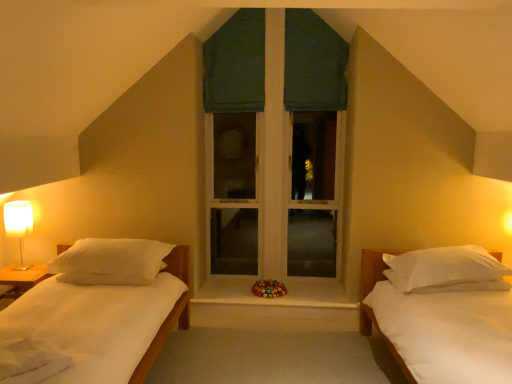
Describe the element at coordinates (236, 64) in the screenshot. I see `dark green fabric at center, acting as the 2th curtain starting from the right` at that location.

You are a GUI agent. You are given a task and a screenshot of the screen. Output one action in this format:
    pyautogui.click(x=<x>, y=<y>)
    Task: Click on the white matte bed at right
    
    Given the screenshot: What is the action you would take?
    pyautogui.click(x=372, y=269)

Describe the element at coordinates (313, 63) in the screenshot. This screenshot has height=384, width=512. I see `green fabric curtain at upper center, acting as the first curtain starting from the right` at that location.

This screenshot has height=384, width=512. What do you see at coordinates (274, 298) in the screenshot?
I see `wooden at center` at bounding box center [274, 298].

The image size is (512, 384). What do you see at coordinates (446, 270) in the screenshot?
I see `white soft pillow at right, placed as the first pillow when sorted from right to left` at bounding box center [446, 270].

Find the location of `dark green fabric at center, acting as the 2th curtain starting from the right`. dark green fabric at center, acting as the 2th curtain starting from the right is located at coordinates (236, 64).

From the image's perspective, is wooden at center located above or below green fabric curtain at upper center, acting as the first curtain starting from the right?

wooden at center is below green fabric curtain at upper center, acting as the first curtain starting from the right.

Could green fabric curtain at upper center, acting as the first curtain starting from the right, be considered to be inside wooden at center?

Actually, green fabric curtain at upper center, acting as the first curtain starting from the right, is outside wooden at center.

In the scene shown: Between wooden at center and green fabric curtain at upper center, which is the 2th curtain in left-to-right order, which one has more height?

green fabric curtain at upper center, which is the 2th curtain in left-to-right order.

This screenshot has width=512, height=384. In order to click on window sill that appears on the left of green fabric curtain at upper center, which is the 2th curtain in left-to-right order in this screenshot , I will do `click(274, 298)`.

Is dark green fabric at center, acting as the 2th curtain starting from the right, inside green fabric window at center?

Indeed, dark green fabric at center, acting as the 2th curtain starting from the right, is located within green fabric window at center.

From the image's perspective, is green fabric window at center located above or below dark green fabric at center, acting as the 2th curtain starting from the right?

green fabric window at center is situated lower than dark green fabric at center, acting as the 2th curtain starting from the right, in the image.

Can you tell me how much green fabric window at center and dark green fabric at center, acting as the 2th curtain starting from the right, differ in facing direction?

The angular difference between green fabric window at center and dark green fabric at center, acting as the 2th curtain starting from the right, is 1.05 degrees.

Does green fabric window at center come behind dark green fabric at center, acting as the 2th curtain starting from the right?

No, the depth of green fabric window at center is less than that of dark green fabric at center, acting as the 2th curtain starting from the right.

Is there a large distance between white matte bed at right and wooden at center?

That's not correct — white matte bed at right is a little close to wooden at center.

Is white matte bed at right not within wooden at center?

Yes, white matte bed at right is not within wooden at center.

This screenshot has height=384, width=512. What are the coordinates of `window sill located below the white matte bed at right (from the image's perspective)` in the screenshot? It's located at [x=274, y=298].

Considering the points (362, 327) and (282, 299), which point is behind, point (362, 327) or point (282, 299)?

The point (282, 299) is behind.

At what (x,y) coordinates should I click in order to perform the action: click on window sill in front of the green fabric window at center. Please return your answer as a coordinate pair (x, y). This screenshot has width=512, height=384. Looking at the image, I should click on (274, 298).

Does wooden at center appear on the left side of green fabric window at center?

Correct, you'll find wooden at center to the left of green fabric window at center.

Is wooden at center bigger or smaller than green fabric window at center?

Considering their sizes, wooden at center takes up less space than green fabric window at center.

Is point (224, 54) closer to viewer compared to point (391, 260)?

No, (224, 54) is behind (391, 260).

In the scene shown: From the image's perspective, is dark green fabric at center, the first curtain positioned from the left, located above or below white soft pillow at right, which appears as the second pillow when viewed from the left?

Clearly, from the image's perspective, dark green fabric at center, the first curtain positioned from the left, is above white soft pillow at right, which appears as the second pillow when viewed from the left.

Can you confirm if dark green fabric at center, the first curtain positioned from the left, is thinner than white soft pillow at right, which appears as the second pillow when viewed from the left?

Correct, the width of dark green fabric at center, the first curtain positioned from the left, is less than that of white soft pillow at right, which appears as the second pillow when viewed from the left.

Is wooden at center bigger or smaller than white soft pillow at right, which appears as the second pillow when viewed from the left?

wooden at center is smaller than white soft pillow at right, which appears as the second pillow when viewed from the left.

From the image's perspective, is wooden at center located above or below white soft pillow at right, placed as the first pillow when sorted from right to left?

wooden at center is situated lower than white soft pillow at right, placed as the first pillow when sorted from right to left, in the image.

What's the angular difference between wooden at center and white soft pillow at right, placed as the first pillow when sorted from right to left,'s facing directions?

The angle between the facing direction of wooden at center and the facing direction of white soft pillow at right, placed as the first pillow when sorted from right to left, is 176 degrees.

Would you say white matte bed at right is to the left or to the right of green fabric window at center in the picture?

Based on their positions, white matte bed at right is located to the right of green fabric window at center.

Is white matte bed at right further to camera compared to green fabric window at center?

No, white matte bed at right is closer to the viewer.

Locate an element on the screen. The image size is (512, 384). window that is above the white matte bed at right (from a real-world perspective) is located at coordinates (276, 155).

This screenshot has width=512, height=384. I want to click on curtain that is the 1st one when counting backward from the wooden at center, so click(x=313, y=63).

From a real-world perspective, starting from the green fabric window at center, which curtain is the 2nd one vertically above it? Please provide its 2D coordinates.

[(236, 64)]

Looking at the image, which one is located further to white soft pillow at right, placed as the first pillow when sorted from right to left, white matte bed at right or white fabric-covered lamp at left?

white fabric-covered lamp at left is further to white soft pillow at right, placed as the first pillow when sorted from right to left.

Looking at the image, which one is located further to white soft pillow at right, which appears as the second pillow when viewed from the left, white fabric-covered lamp at left or green fabric window at center?

white fabric-covered lamp at left lies further to white soft pillow at right, which appears as the second pillow when viewed from the left, than the other object.

When comparing their distances from wooden at center, does dark green fabric at center, acting as the 2th curtain starting from the right, or green fabric window at center seem closer?

green fabric window at center.

Considering their positions, is white soft pillow at right, placed as the first pillow when sorted from right to left, positioned further to white soft pillow at left, which appears as the 2th pillow when viewed from the right, than white matte bed at right?

white soft pillow at right, placed as the first pillow when sorted from right to left.

Which object lies nearer to the anchor point white fabric-covered lamp at left, white matte bed at right or dark green fabric at center, the first curtain positioned from the left?

dark green fabric at center, the first curtain positioned from the left.

When comparing their distances from white matte bed at right, does green fabric curtain at upper center, which is the 2th curtain in left-to-right order, or white fabric-covered lamp at left seem further?

Based on the image, white fabric-covered lamp at left appears to be further to white matte bed at right.

From the image, which object appears to be farther from white soft pillow at right, which appears as the second pillow when viewed from the left, green fabric window at center or white fabric-covered lamp at left?

Among the two, white fabric-covered lamp at left is located further to white soft pillow at right, which appears as the second pillow when viewed from the left.

Based on their spatial positions, is green fabric window at center or white fabric-covered lamp at left further from white matte bed at right?

white fabric-covered lamp at left.

Locate an element on the screen. Image resolution: width=512 pixels, height=384 pixels. window between dark green fabric at center, acting as the 2th curtain starting from the right, and white soft pillow at left, marked as the 1th pillow in a left-to-right arrangement, from top to bottom is located at coordinates (276, 155).

The image size is (512, 384). I want to click on window between green fabric curtain at upper center, acting as the first curtain starting from the right, and white soft pillow at right, which appears as the second pillow when viewed from the left, in the up-down direction, so click(276, 155).

The height and width of the screenshot is (384, 512). What are the coordinates of `window situated between white soft pillow at left, marked as the 1th pillow in a left-to-right arrangement, and white soft pillow at right, placed as the first pillow when sorted from right to left, from left to right` in the screenshot? It's located at (276, 155).

I want to click on pillow between white fabric-covered lamp at left and wooden at center, so click(110, 261).